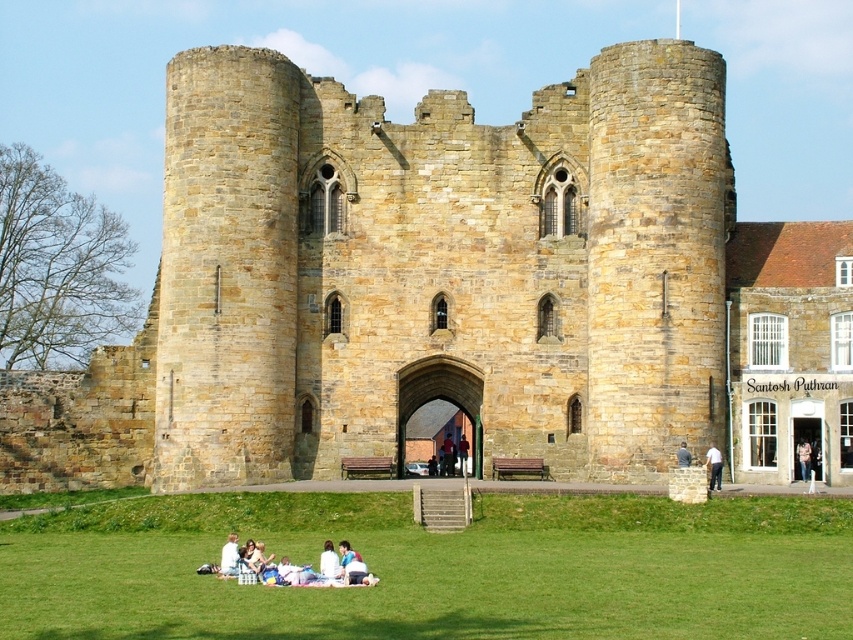
You are standing in front of the castle and see the green grass at lower center and the light brown hair at lower center. Which object is located lower in the image?

The green grass at lower center is located below the light brown hair at lower center, so the green grass at lower center is lower in the image.

You are standing in front of the historic stone castle and want to find a spot to place a picnic blanket. Based on the image, is the green grass at lower center represented by point [438,568] a suitable location for placing your blanket?

Yes, the green grass at lower center represented by point [438,568] is a suitable location for placing your picnic blanket since it is already where a group is seated on a blanket.

You are a visitor standing in front of the brown stone castle at center. You notice a person wearing a red shirt at center nearby. Which object is taller between the two?

The brown stone castle at center is taller than the red shirt at center.